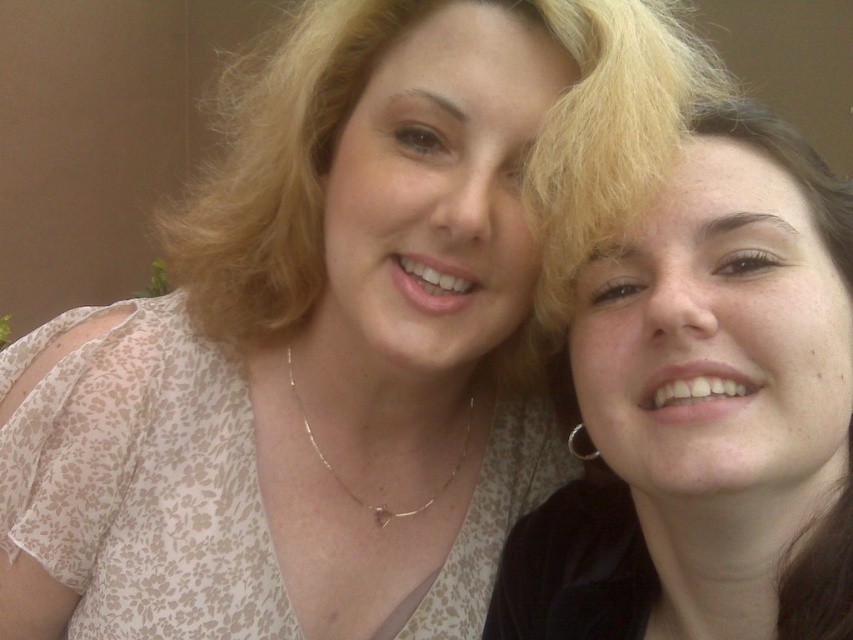
You are taking a photo of two people standing in front of you. The person on the left is wearing a floral blouse and the person on the right is wearing a black top. You want to focus on the point at point (561, 579). Is this point within the focus range of your camera, which can focus on objects between 25 and 30 inches away?

The point (561, 579) is 28.22 inches from the camera, which falls within the focus range of 25 to 30 inches. Therefore, the camera can focus on this point.

You are a photographer trying to adjust the lighting for a portrait. You notice the blondehair at center and the silver metallic earring at right. Which object should you focus on if you want to highlight the taller one?

The blondehair at center is much taller than the silver metallic earring at right, so you should focus on the blondehair at center to highlight the taller one.

In the scene shown: You are a photographer trying to adjust the lighting for a portrait. You notice the matte white blouse at right and the blondehair at center. Which object should you focus on to ensure proper exposure since it is closer to the camera?

The matte white blouse at right is in front of blondehair at center, so you should focus on the matte white blouse at right for proper exposure as it is closer to the camera.